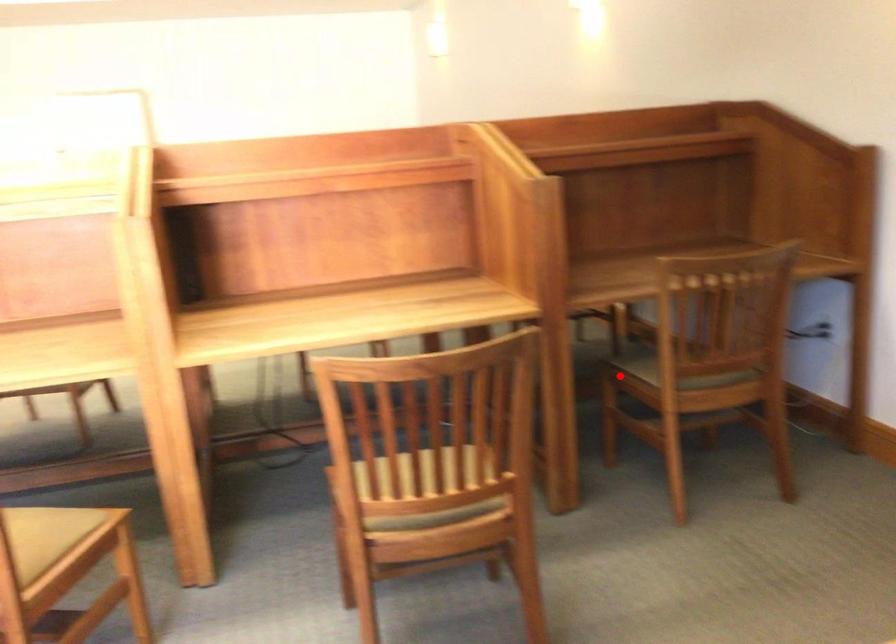
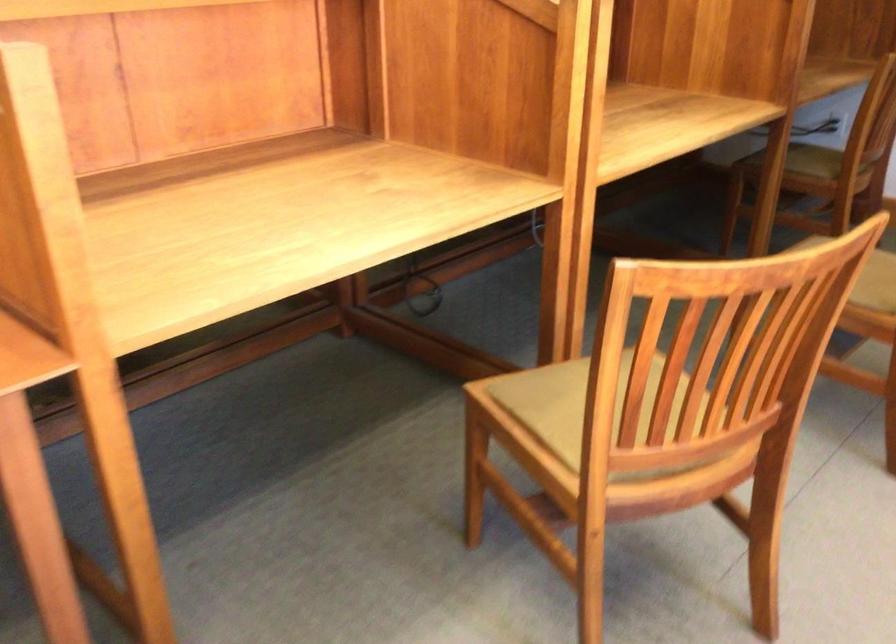
Find the pixel in the second image that matches the highlighted location in the first image.

(814, 161)